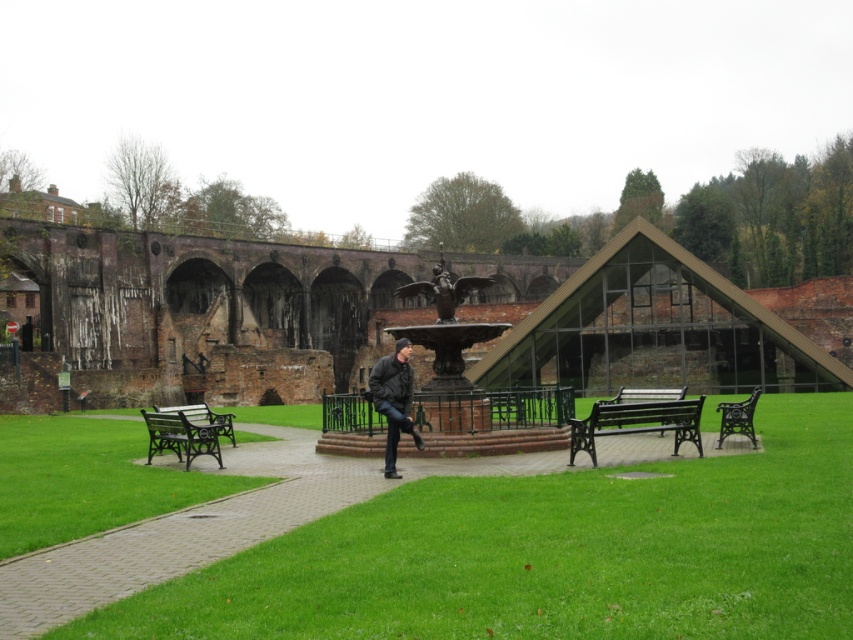
You are standing at the statue and want to walk to the nearest point between point (407,356) and point (683,396). Which point should you walk towards?

You should walk towards point (407,356) because it is closer to you than point (683,396).

You are a park visitor who just arrived and see the green grass at center and the dark gray leather jacket at center. Which object is closer to the ground?

The green grass at center is located below dark gray leather jacket at center, so the green grass at center is closer to the ground.